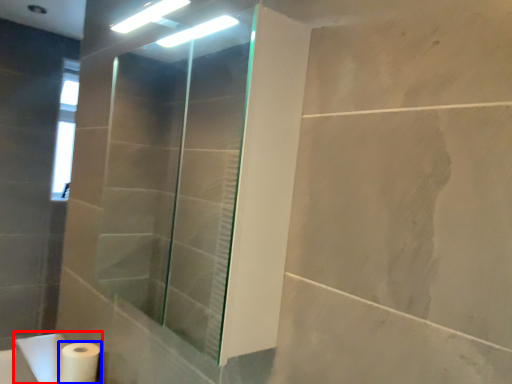
Question: Among these objects, which one is nearest to the camera, sink (highlighted by a red box) or toilet paper (highlighted by a blue box)?

Choices:
 (A) sink
 (B) toilet paper

Answer: (A)